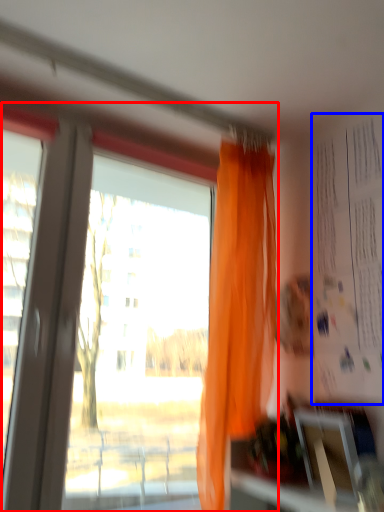
Question: Which point is closer to the camera, window (highlighted by a red box) or bulletin board (highlighted by a blue box)?

Choices:
 (A) window
 (B) bulletin board

Answer: (A)